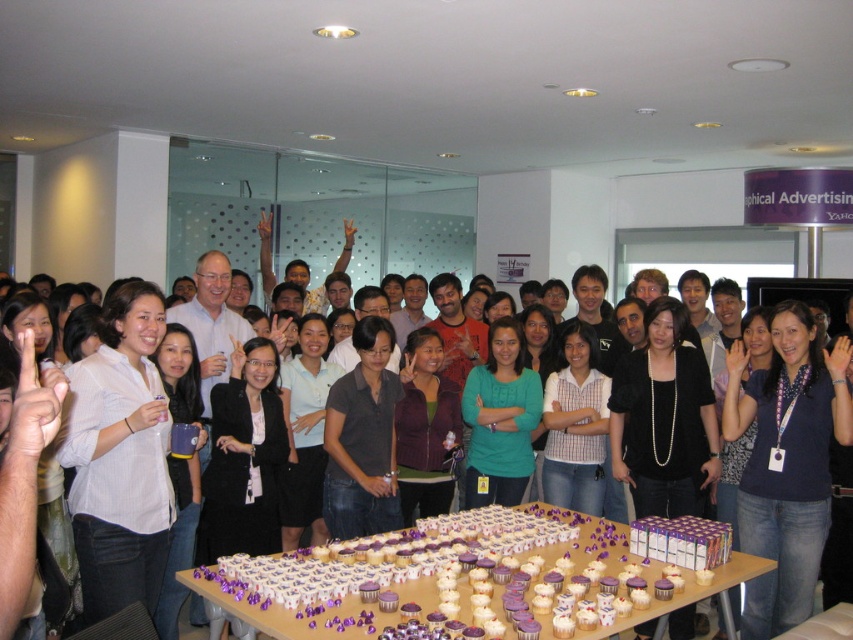
Which is above, white cardboard table at center or blue fabric shirt at center?

blue fabric shirt at center is above.

Between white cardboard table at center and blue fabric shirt at center, which one appears on the left side from the viewer's perspective?

From the viewer's perspective, white cardboard table at center appears more on the left side.

Is point (469, 548) closer to viewer compared to point (831, 420)?

Yes.

Locate an element on the screen. The image size is (853, 640). white cardboard table at center is located at coordinates (473, 579).